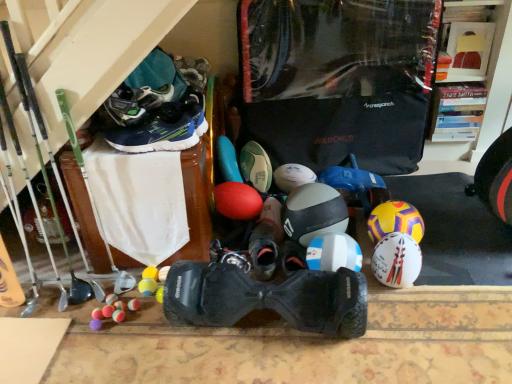
Find the location of a particular element. Image resolution: width=512 pixels, height=384 pixels. free location to the right of rubber ball at center is located at coordinates (433, 198).